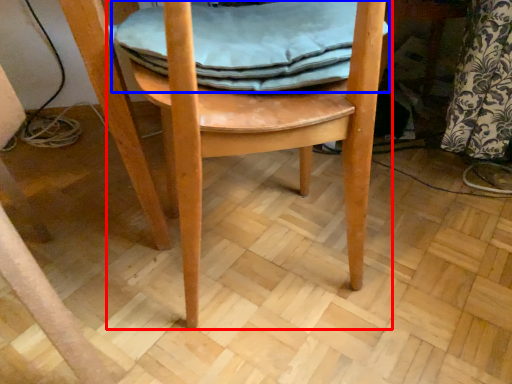
Question: Which point is closer to the camera, chair (highlighted by a red box) or material (highlighted by a blue box)?

Choices:
 (A) chair
 (B) material

Answer: (A)